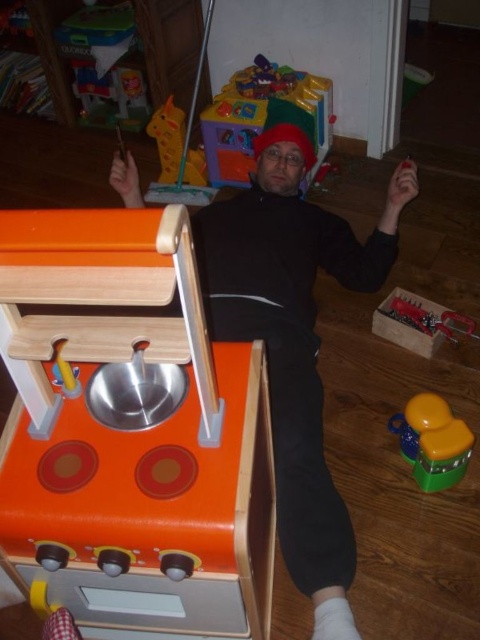
Question: Which point is closer to the camera?

Choices:
 (A) translucent green toy at lower right
 (B) black matte clothing at center

Answer: (B)

Question: In this image, where is black matte clothing at center located relative to translucent green toy at lower right?

Choices:
 (A) right
 (B) left

Answer: (B)

Question: Which object appears farthest from the camera in this image?

Choices:
 (A) black matte clothing at center
 (B) translucent green toy at lower right

Answer: (B)

Question: Which object appears closest to the camera in this image?

Choices:
 (A) black matte clothing at center
 (B) translucent green toy at lower right

Answer: (A)

Question: Is black matte clothing at center positioned in front of translucent green toy at lower right?

Choices:
 (A) no
 (B) yes

Answer: (B)

Question: Can you confirm if black matte clothing at center is wider than translucent green toy at lower right?

Choices:
 (A) yes
 (B) no

Answer: (A)